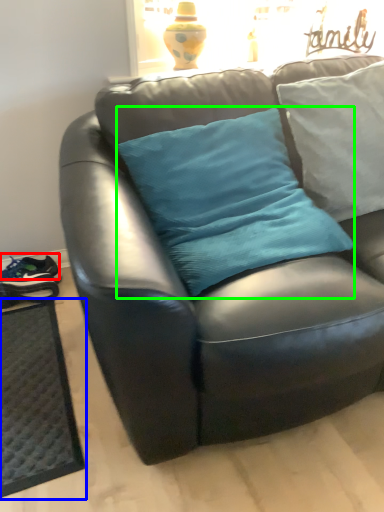
Question: Which object is the closest to the running shoe (highlighted by a red box)? Choose among these: doormat (highlighted by a blue box) or pillow (highlighted by a green box).

Choices:
 (A) doormat
 (B) pillow

Answer: (A)